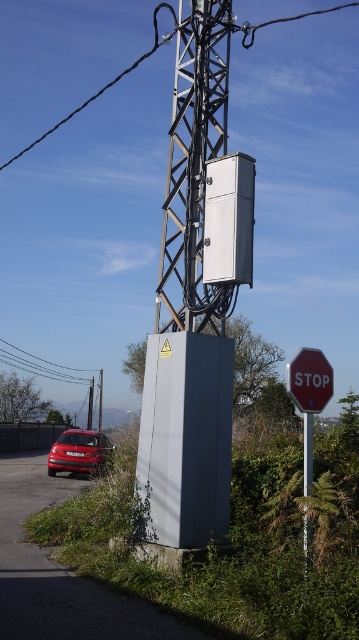
Which is above, metallic wire at upper center or gray metallic pole at center?

metallic wire at upper center is above.

Is metallic wire at upper center thinner than gray metallic pole at center?

In fact, metallic wire at upper center might be wider than gray metallic pole at center.

Measure the distance between point (67, 116) and camera.

Point (67, 116) and camera are 43.89 meters apart.

Locate an element on the screen. metallic wire at upper center is located at coordinates (98, 92).

Looking at this image, can you confirm if gray metallic utility box at center is taller than metallic red car at lower left?

Incorrect, gray metallic utility box at center's height is not larger of metallic red car at lower left's.

Is gray metallic utility box at center bigger than metallic red car at lower left?

Actually, gray metallic utility box at center might be smaller than metallic red car at lower left.

Does point (178, 180) come behind point (59, 449)?

No, it is in front of (59, 449).

Image resolution: width=359 pixels, height=640 pixels. I want to click on gray metallic utility box at center, so click(190, 312).

How far apart are gray metallic utility box at center and red matte stop sign at center right?

The distance of gray metallic utility box at center from red matte stop sign at center right is 1.79 meters.

Is gray metallic utility box at center shorter than red matte stop sign at center right?

Correct, gray metallic utility box at center is not as tall as red matte stop sign at center right.

You are a GUI agent. You are given a task and a screenshot of the screen. Output one action in this format:
    pyautogui.click(x=<x>, y=<y>)
    Task: Click on the gray metallic utility box at center
    Image resolution: width=359 pixels, height=640 pixels.
    Given the screenshot: What is the action you would take?
    pyautogui.click(x=190, y=312)